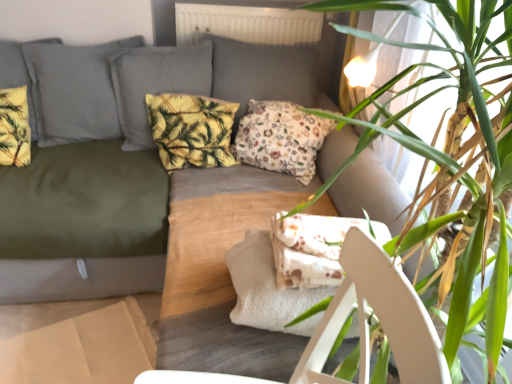
Question: Considering the positions of white fabric armchair at center and white cardboard box at lower left in the image, is white fabric armchair at center taller or shorter than white cardboard box at lower left?

Choices:
 (A) short
 (B) tall

Answer: (B)

Question: Does point (x=410, y=372) appear closer or farther from the camera than point (x=119, y=347)?

Choices:
 (A) closer
 (B) farther

Answer: (A)

Question: Which is nearer to the yellow fabric pillow at center, which is counted as the second pillow, starting from the right?

Choices:
 (A) floral fabric pillow at center, acting as the third pillow starting from the left
 (B) yellow floral fabric pillow at upper left, which appears as the 1th pillow when viewed from the left
 (C) white fabric armchair at center
 (D) olive green fabric couch at upper left
 (E) green leafy plant at upper right

Answer: (A)

Question: Estimate the real-world distances between objects in this image. Which object is farther from the yellow fabric pillow at center, which is counted as the second pillow, starting from the right?

Choices:
 (A) olive green fabric couch at upper left
 (B) green leafy plant at upper right
 (C) yellow floral fabric pillow at upper left, marked as the 3th pillow in a right-to-left arrangement
 (D) white cardboard box at lower left
 (E) white fabric armchair at center

Answer: (E)